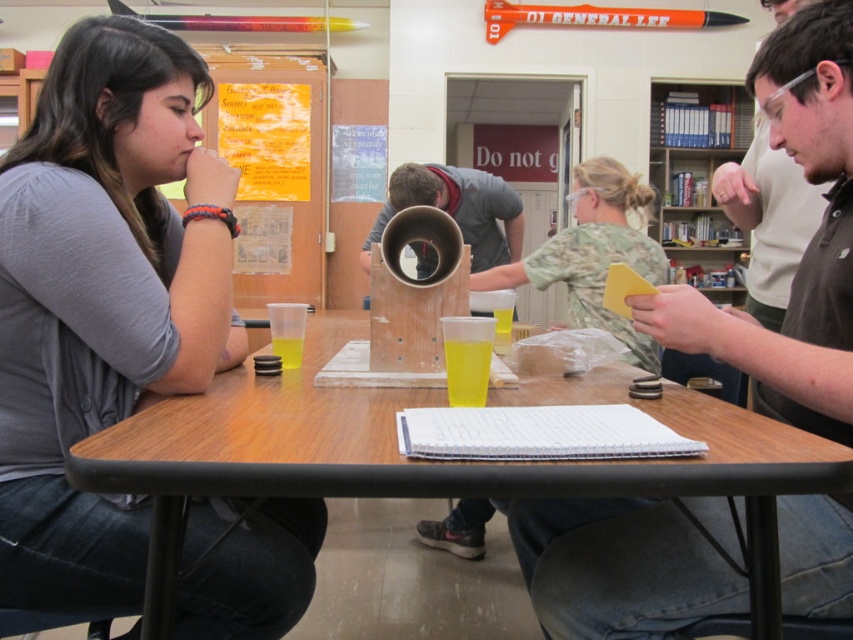
Question: Which object appears farthest from the camera in this image?

Choices:
 (A) matte brown shirt at center
 (B) camouflage fabric shirt at center

Answer: (B)

Question: Is matte brown shirt at center bigger than wooden pipe at center?

Choices:
 (A) yes
 (B) no

Answer: (B)

Question: Based on their relative distances, which object is farther from the camouflage fabric shirt at center?

Choices:
 (A) wooden pipe at center
 (B) wooden table at center

Answer: (B)

Question: Which object is the farthest from the translucent plastic cup at table center?

Choices:
 (A) matte brown shirt at center
 (B) wooden pipe at center
 (C) camouflage fabric shirt at center

Answer: (B)

Question: Does matte brown shirt at center lie in front of camouflage fabric shirt at center?

Choices:
 (A) no
 (B) yes

Answer: (B)

Question: Can you confirm if wooden pipe at center is thinner than yellow translucent cup at table center?

Choices:
 (A) yes
 (B) no

Answer: (B)